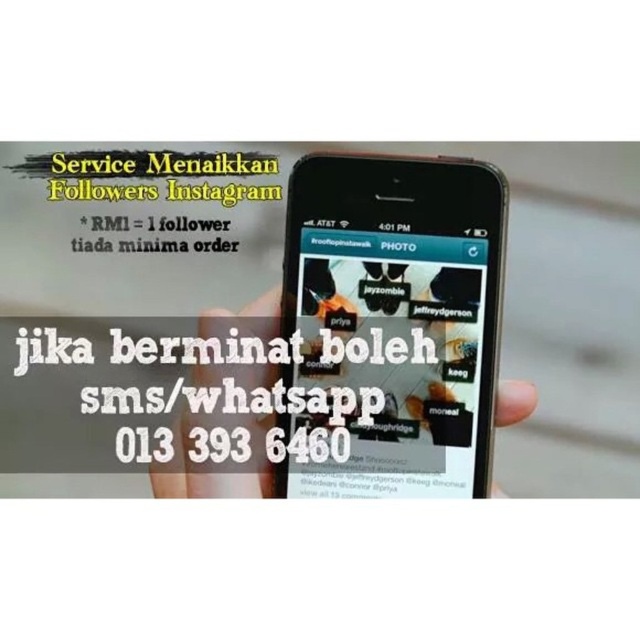
You are designing a layout for an advertisement and need to place the black matte phone at center and the white paper at center. According to the scene description, where should you position the black matte phone relative to the white paper?

The black matte phone at center should be positioned above the white paper at center.

You are designing a layout for a promotional poster and need to place a black matte phone at center and a white paper at center. Given their sizes, which object should be placed closer to the viewer to maintain visual balance?

The black matte phone at center should be placed closer to the viewer since it is smaller in size compared to the white paper at center, helping to balance the visual weight in the composition.

You are designing a layout for a new Instagram promotion ad. The ad must include a smartphone displaying the service details. Where should you place the black matte phone at center to match the original ad?

The black matte phone at center should be placed at point (392, 324) to match the original ad.